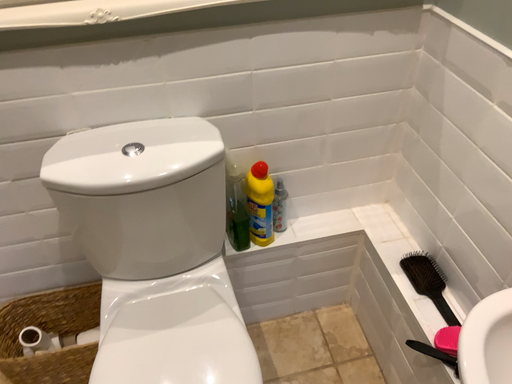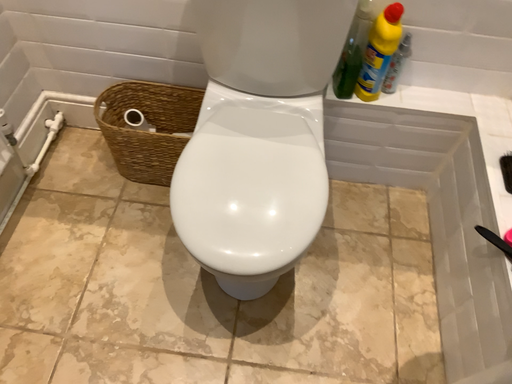
Question: Which way did the camera rotate in the video?

Choices:
 (A) rotated left
 (B) rotated right

Answer: (A)